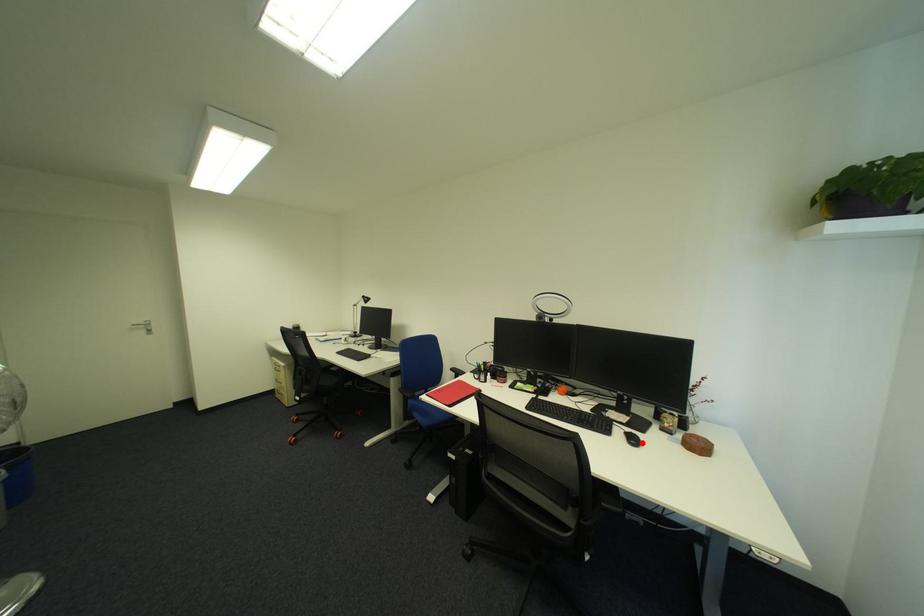
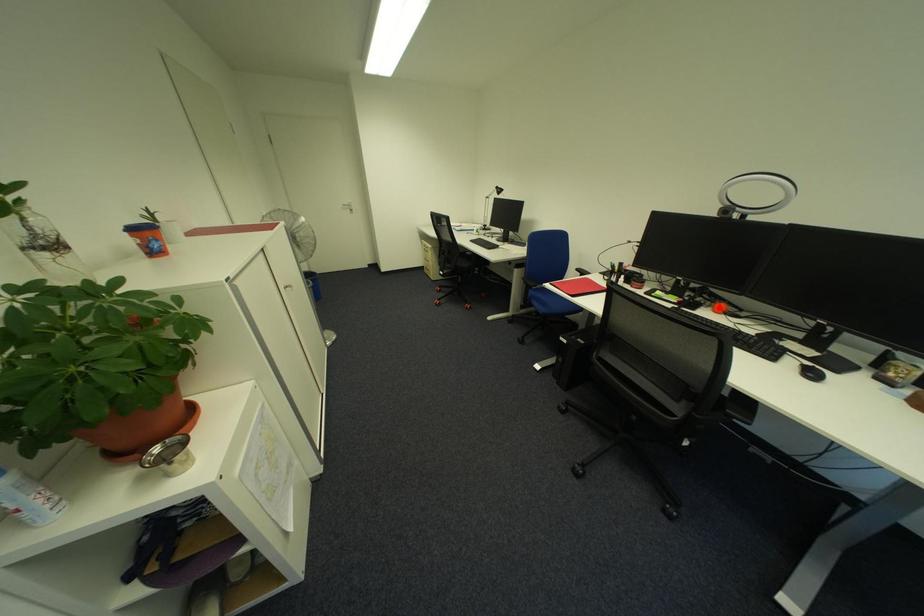
I am providing you with two images of the same scene from different viewpoints. A red point is marked on the first image and another point is marked on the second image. Is the red point in image1 aligned with the point shown in image2?

No